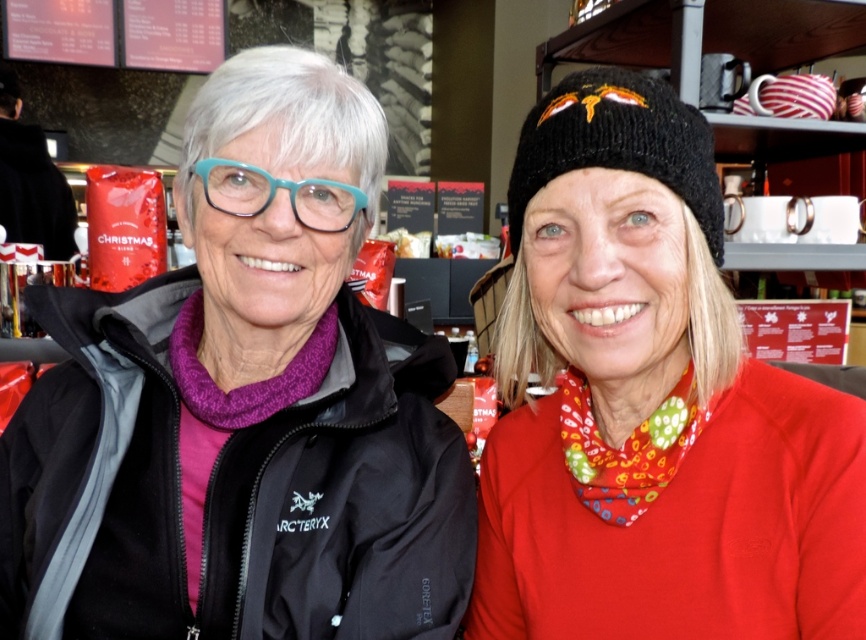
You are a customer in a store and want to buy a hat and a pair of glasses. You see the black knitted beanie at upper center and the teal plastic glasses at center. Which item is taller when placed side by side?

The black knitted beanie at upper center is taller than the teal plastic glasses at center.

You are a delivery person who needs to place a small package between the black matte jacket at center and the black knitted beanie at upper center. The package is 20 centimeters long. Will it fit in the space between them?

The black matte jacket at center is 23.18 centimeters away from the black knitted beanie at upper center. Since the package is 20 centimeters long, it will fit in the space between them as the distance is sufficient.

You are trying to decide whether to place a decorative item on a shelf that can only hold items up to the size of the teal plastic glasses at center. Can the black knitted hat at upper right fit on this shelf?

The black knitted hat at upper right is larger in size than the teal plastic glasses at center, so it cannot fit on the shelf designated for items up to the size of the teal plastic glasses at center.